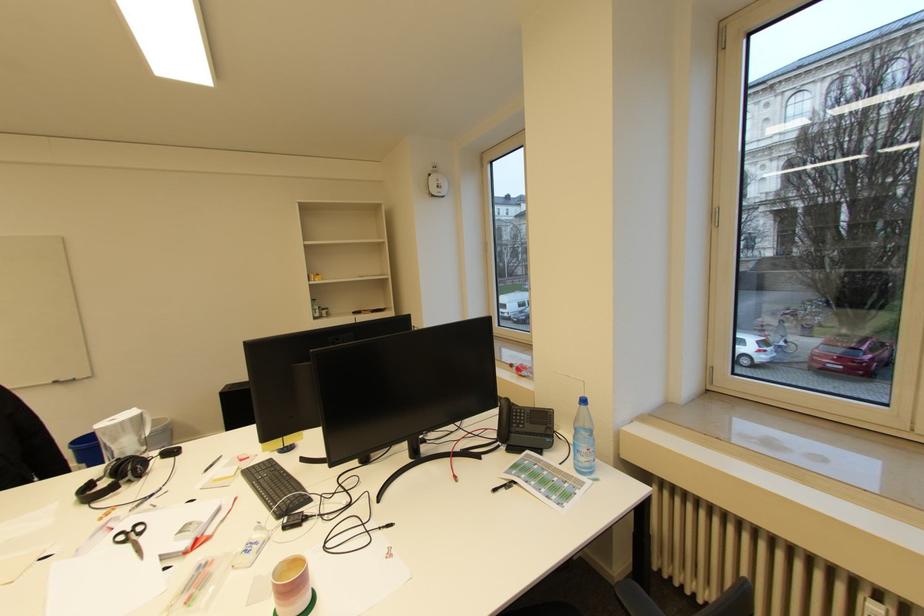
Where is `keyboard key`? This screenshot has height=616, width=924. keyboard key is located at coordinates (275, 487).